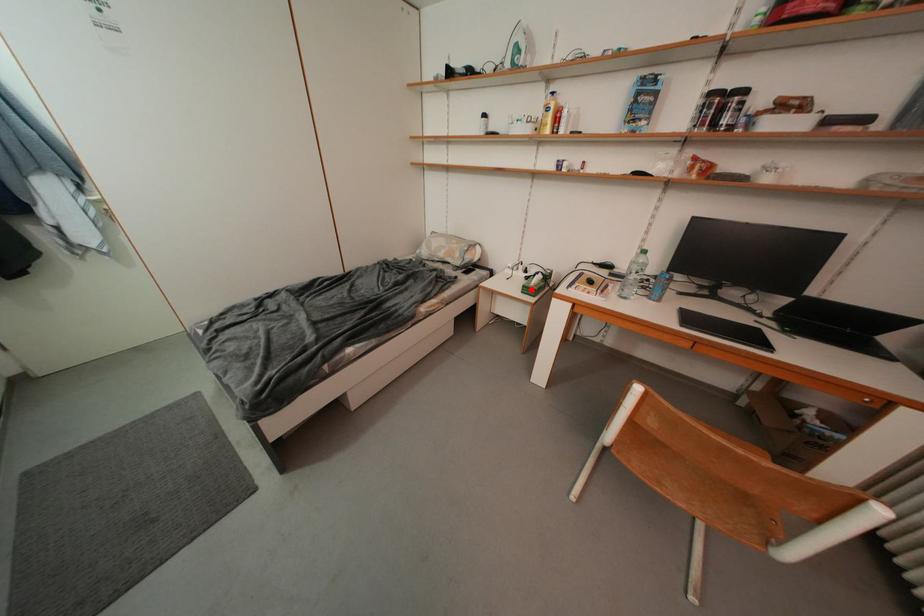
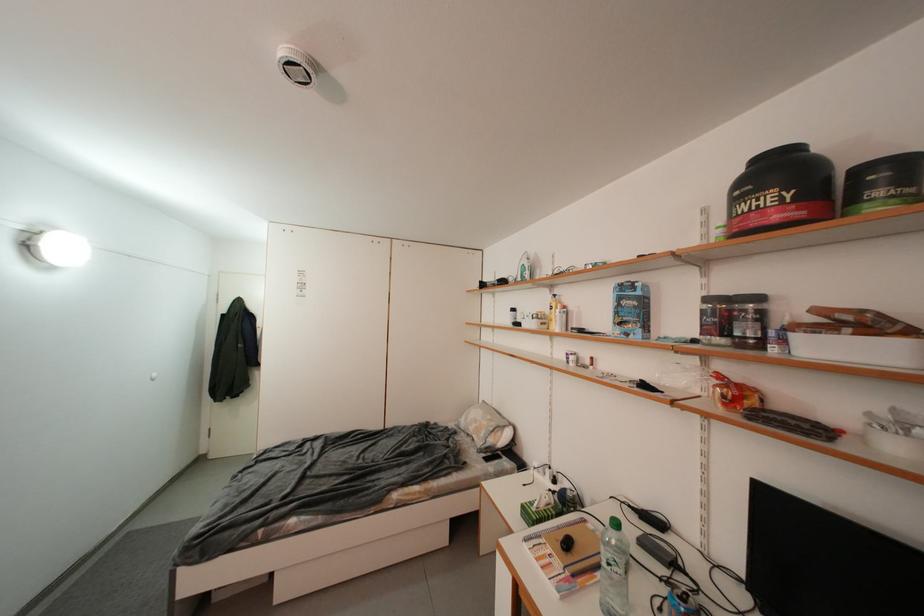
Locate, in the second image, the point that corresponds to the highlighted location in the first image.

(530, 509)